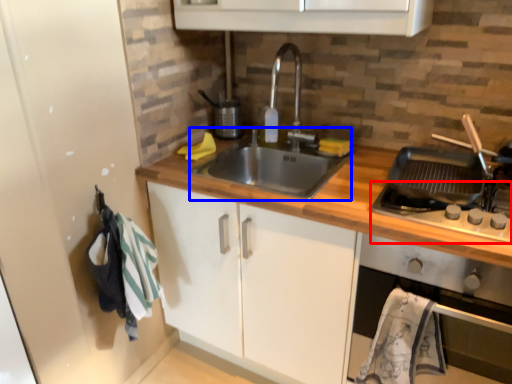
Question: Which point is further to the camera, gas stove (highlighted by a red box) or sink (highlighted by a blue box)?

Choices:
 (A) gas stove
 (B) sink

Answer: (B)